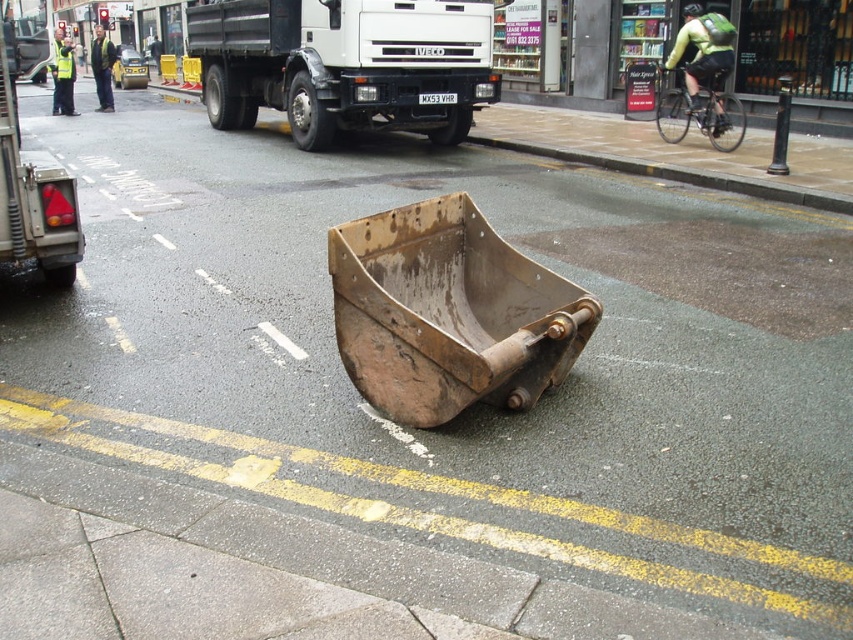
Who is taller, brown wooden bucket at center or high visibility yellow jacket at upper left?

With more height is high visibility yellow jacket at upper left.

Is brown wooden bucket at center bigger than high visibility yellow jacket at upper left?

No, brown wooden bucket at center is not bigger than high visibility yellow jacket at upper left.

Between point (711, 172) and point (56, 65), which one is positioned in front?

Point (711, 172) is in front.

This screenshot has height=640, width=853. In order to click on brown wooden bucket at center in this screenshot , I will do `click(676, 154)`.

Which is more to the right, white matte truck at upper center or dark green jacket at upper left?

white matte truck at upper center

Is point (227, 54) closer to viewer compared to point (107, 84)?

Yes, it is.

Between point (222, 58) and point (91, 60), which one is positioned in front?

Point (222, 58) is more forward.

I want to click on white matte truck at upper center, so click(345, 65).

Does white matte truck at upper center appear over green reflective jacket at upper right?

Indeed, white matte truck at upper center is positioned over green reflective jacket at upper right.

Which is in front, point (387, 74) or point (677, 38)?

Point (677, 38) is in front.

Describe the element at coordinates (345, 65) in the screenshot. Image resolution: width=853 pixels, height=640 pixels. I see `white matte truck at upper center` at that location.

Find the location of a particular element. white matte truck at upper center is located at coordinates (345, 65).